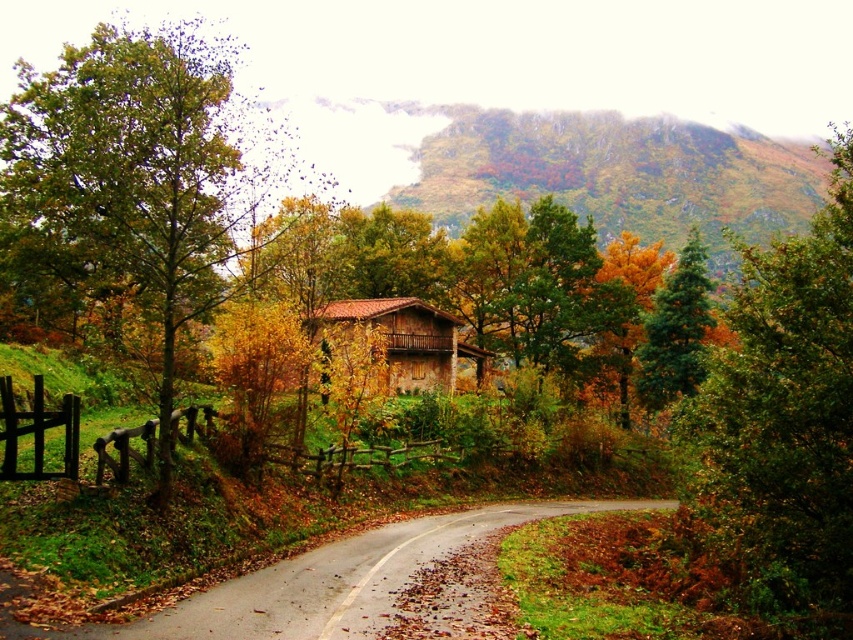
You are standing at point (135, 177) in the image. What object is located exactly at this point?

Result: The green matte tree at center is located exactly at point (135, 177).

You are driving along the curving road in the image and see two points marked on your GPS. The first point is at point [144,58] and the second is at point [624,182]. According to the scene, which point is closer to you as you drive along the road?

Point [144,58] is in front of point [624,182], so the first point is closer to you as you drive along the road.